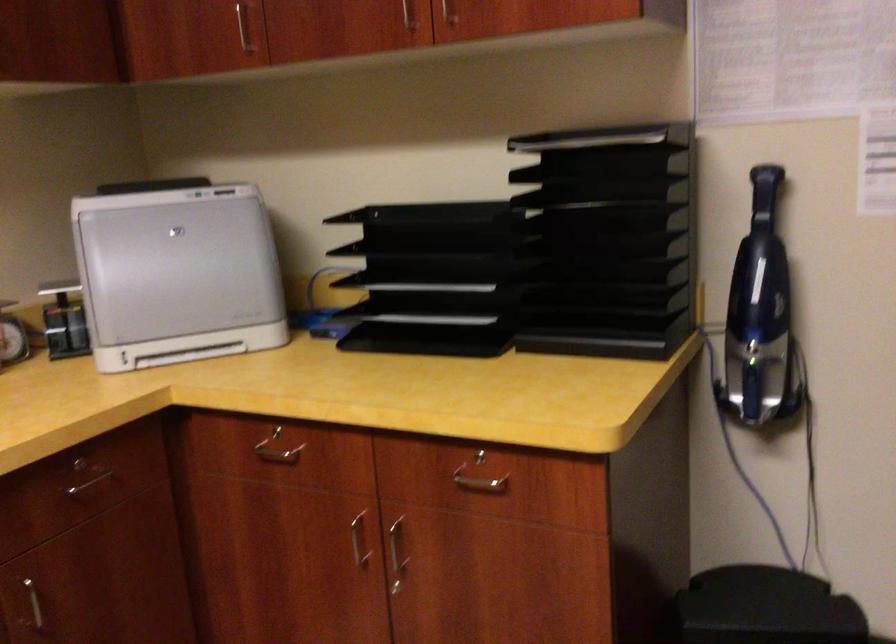
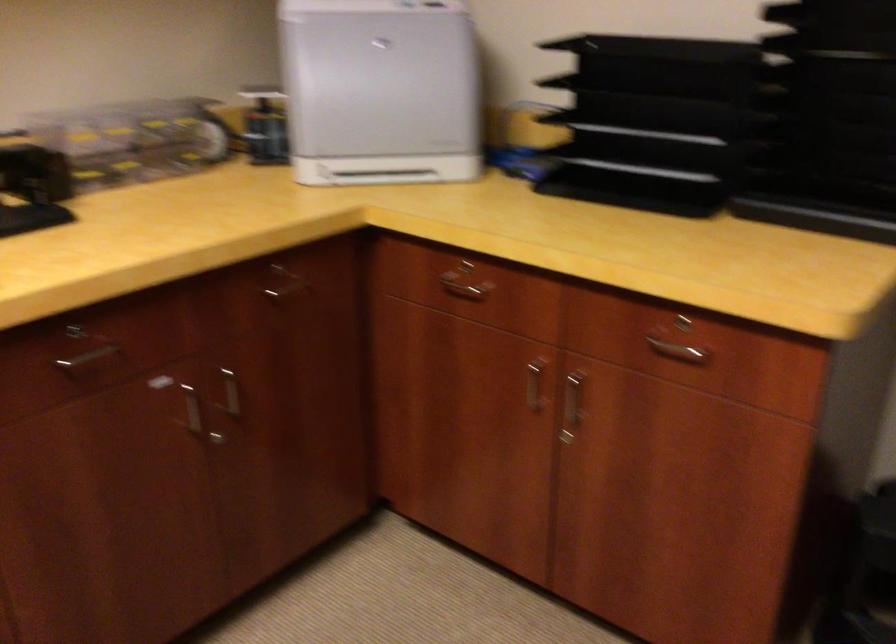
Where in the second image is the point corresponding to [418,225] from the first image?

(640, 62)